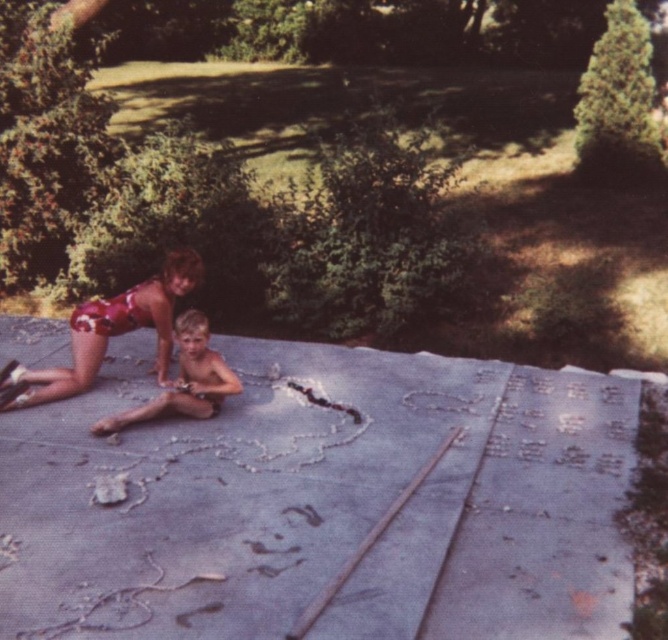
What object is located at the coordinates point (114, 330) in the image?

The shiny metallic bikini top at lower left is located at point (114, 330).